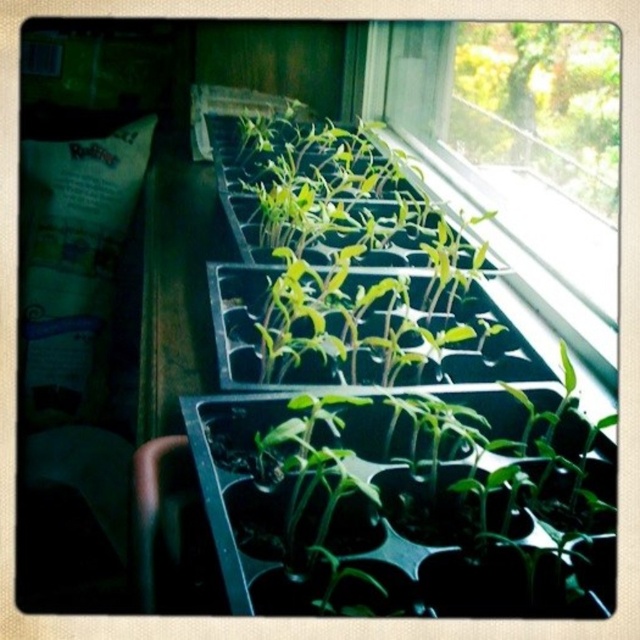
Question: Does green matte seedlings at center appear on the right side of transparent plastic tray of seedlings at upper right?

Choices:
 (A) yes
 (B) no

Answer: (B)

Question: Which of the following is the closest to the observer?

Choices:
 (A) (410, 298)
 (B) (582, 284)

Answer: (A)

Question: Among these objects, which one is nearest to the camera?

Choices:
 (A) green matte seedlings at center
 (B) transparent plastic tray of seedlings at upper right

Answer: (A)

Question: Where is green matte seedlings at center located in relation to transparent plastic tray of seedlings at upper right in the image?

Choices:
 (A) below
 (B) above

Answer: (A)

Question: Which point is farther from the camera taking this photo?

Choices:
 (A) (252, 134)
 (B) (557, 301)

Answer: (A)

Question: From the image, what is the correct spatial relationship of green matte seedlings at center in relation to transparent plastic tray of seedlings at upper right?

Choices:
 (A) above
 (B) below

Answer: (B)